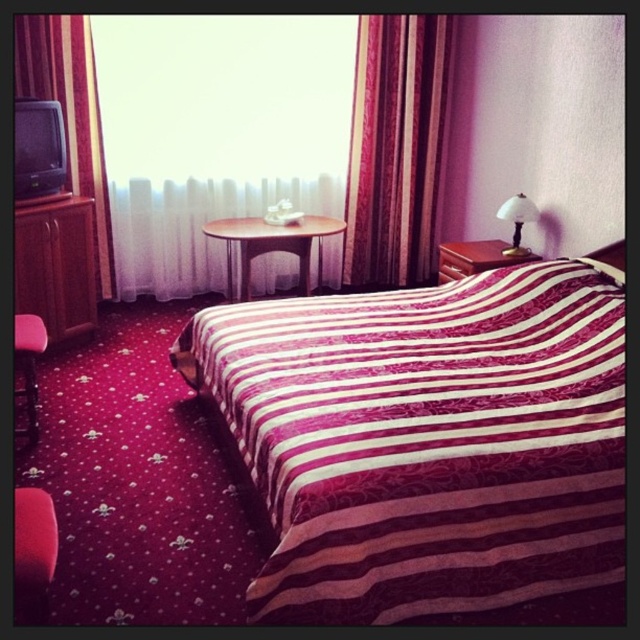
Does velvet-like burgundy curtain at left have a greater width compared to matte wood nightstand at right?

No, velvet-like burgundy curtain at left is not wider than matte wood nightstand at right.

Between point (104, 264) and point (445, 257), which one is positioned in front?

Point (445, 257) is more forward.

I want to click on velvet-like burgundy curtain at left, so click(x=70, y=112).

Does velvet-like burgundy curtain at left lie in front of wooden table at center?

Yes.

Is point (92, 196) closer to camera compared to point (228, 273)?

Yes, point (92, 196) is closer to viewer.

Is point (45, 52) positioned in front of point (294, 237)?

Yes, it is in front of point (294, 237).

At what (x,y) coordinates should I click in order to perform the action: click on velvet-like burgundy curtain at left. Please return your answer as a coordinate pair (x, y). Looking at the image, I should click on (70, 112).

Who is lower down, striped fabric bed at center or white sheer curtain at center?

Positioned lower is striped fabric bed at center.

Who is taller, striped fabric bed at center or white sheer curtain at center?

white sheer curtain at center

Identify the location of striped fabric bed at center. (426, 440).